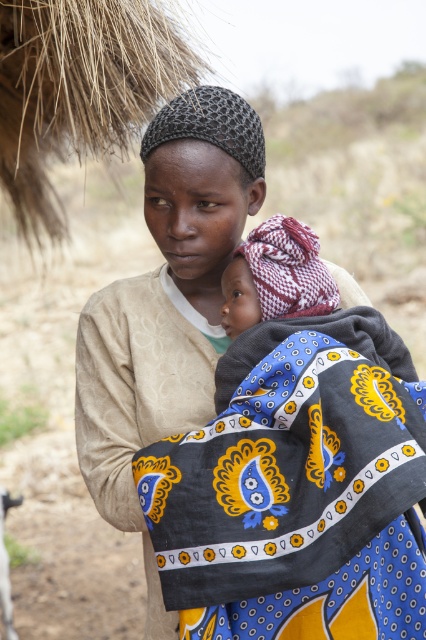
Question: Observing the image, what is the correct spatial positioning of matte beige shirt at center in reference to patterned fabric baby at center?

Choices:
 (A) above
 (B) below

Answer: (B)

Question: Is dark blue fabric with yellow and white patterns at center further to the viewer compared to patterned fabric baby at center?

Choices:
 (A) no
 (B) yes

Answer: (A)

Question: Which object appears farthest from the camera in this image?

Choices:
 (A) patterned fabric baby at center
 (B) dark blue fabric with yellow and white patterns at center
 (C) matte beige shirt at center

Answer: (A)

Question: Is matte beige shirt at center below patterned fabric baby at center?

Choices:
 (A) yes
 (B) no

Answer: (A)

Question: Based on their relative distances, which object is farther from the matte beige shirt at center?

Choices:
 (A) dark blue fabric with yellow and white patterns at center
 (B) patterned fabric baby at center

Answer: (A)

Question: Which object is closer to the camera taking this photo?

Choices:
 (A) matte beige shirt at center
 (B) dark blue fabric with yellow and white patterns at center

Answer: (B)